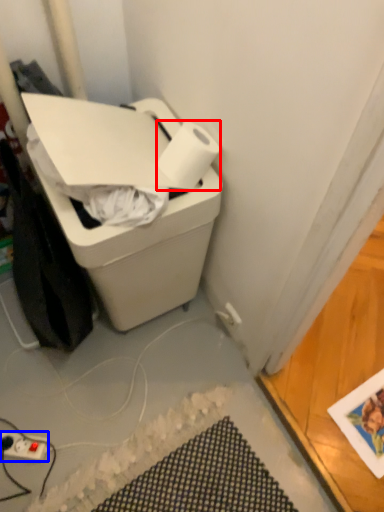
Question: Which object appears farthest to the camera in this image, paper towel (highlighted by a red box) or power plugs and sockets (highlighted by a blue box)?

Choices:
 (A) paper towel
 (B) power plugs and sockets

Answer: (B)